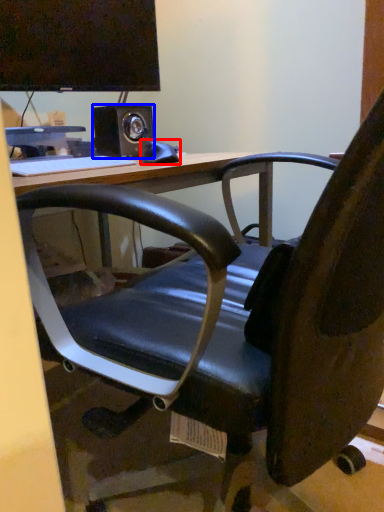
Question: Which object appears farthest to the camera in this image, equipment (highlighted by a red box) or speaker (highlighted by a blue box)?

Choices:
 (A) equipment
 (B) speaker

Answer: (B)